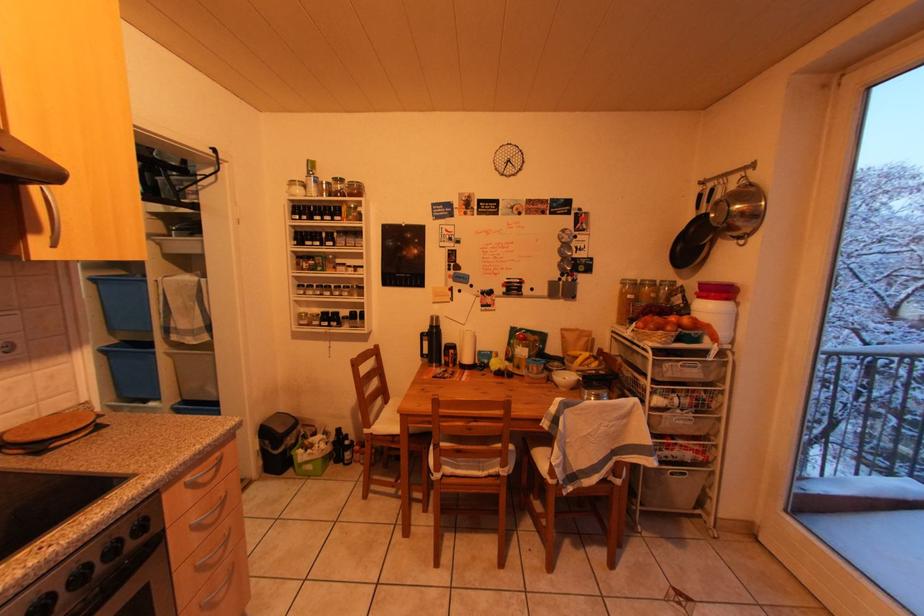
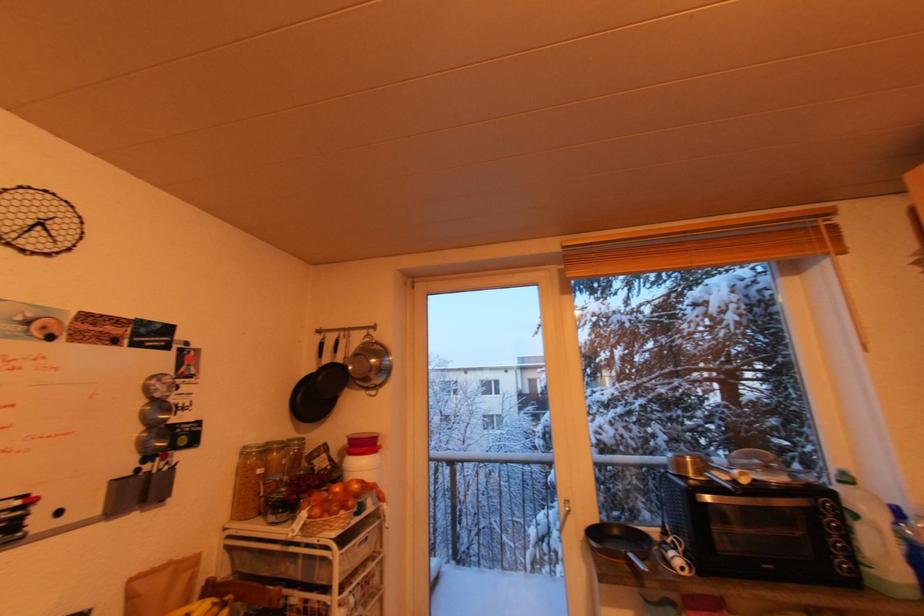
Question: The first image is from the beginning of the video and the second image is from the end. How did the camera likely rotate when shooting the video?

Choices:
 (A) Left
 (B) Right
 (C) Up
 (D) Down

Answer: (B)